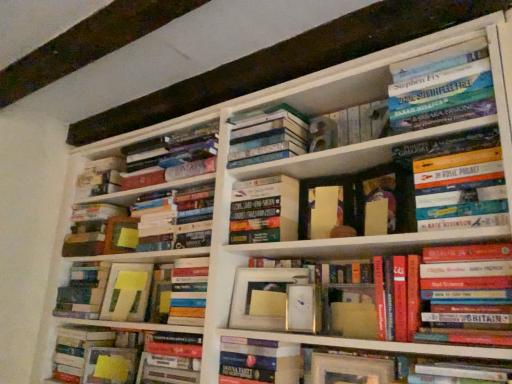
Question: Considering the positions of hardcover book at upper center, which ranks as the fifth book in right-to-left order, and hardcover books at center, arranged as the 10th book when viewed from the left, in the image, is hardcover book at upper center, which ranks as the fifth book in right-to-left order, bigger or smaller than hardcover books at center, arranged as the 10th book when viewed from the left,?

Choices:
 (A) small
 (B) big

Answer: (A)

Question: Is hardcover book at upper center, which ranks as the fifth book in right-to-left order, spatially inside hardcover books at center, arranged as the 10th book when viewed from the left, or outside of it?

Choices:
 (A) outside
 (B) inside

Answer: (A)

Question: Which object is the farthest from the matte yellow sticky notes at center, the 1th book when ordered from left to right?

Choices:
 (A) yellow matte paper at center, which appears as the third paperback book when viewed from the right
 (B) hardcover books at center, which is counted as the 3th book, starting from the right
 (C) hardcover book at center, acting as the tenth book starting from the right
 (D) hardcover book at upper center, the eighth book positioned from the left
 (E) hardcover book at center, placed as the fourth book when sorted from right to left

Answer: (B)

Question: Considering the real-world distances, which object is closest to the hardcover book at upper center, the eighth book positioned from the left?

Choices:
 (A) hardcover book at center, which appears as the 7th book when viewed from the left
 (B) hardcover books at center, arranged as the 10th book when viewed from the left
 (C) hardcover book at center, which is the 11th book from right to left
 (D) hardcover book at upper right, acting as the eleventh book starting from the left
 (E) matte yellow paper at center, the 2th paperback book positioned from the left

Answer: (A)